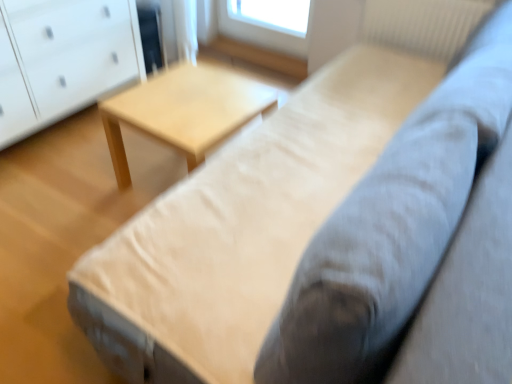
Question: Is light wood table at center oriented towards white glossy chest of drawers at left?

Choices:
 (A) no
 (B) yes

Answer: (A)

Question: From the image's perspective, is light wood table at center under white glossy chest of drawers at left?

Choices:
 (A) yes
 (B) no

Answer: (A)

Question: Can you confirm if light wood table at center is shorter than white glossy chest of drawers at left?

Choices:
 (A) no
 (B) yes

Answer: (B)

Question: Is light wood table at center wider than white glossy chest of drawers at left?

Choices:
 (A) no
 (B) yes

Answer: (B)

Question: Is light wood table at center at the right side of white glossy chest of drawers at left?

Choices:
 (A) yes
 (B) no

Answer: (A)

Question: From the image's perspective, is white glossy chest of drawers at left located above or below white textured radiator at upper right?

Choices:
 (A) above
 (B) below

Answer: (B)

Question: From a real-world perspective, is white glossy chest of drawers at left physically located above or below white textured radiator at upper right?

Choices:
 (A) below
 (B) above

Answer: (A)

Question: Based on their sizes in the image, would you say white glossy chest of drawers at left is bigger or smaller than white textured radiator at upper right?

Choices:
 (A) big
 (B) small

Answer: (A)

Question: Considering their positions, is white glossy chest of drawers at left located in front of or behind white textured radiator at upper right?

Choices:
 (A) behind
 (B) front

Answer: (B)

Question: Considering the positions of light wood table at center and white textured radiator at upper right in the image, is light wood table at center taller or shorter than white textured radiator at upper right?

Choices:
 (A) short
 (B) tall

Answer: (A)

Question: Looking at the image, does light wood table at center seem bigger or smaller compared to white textured radiator at upper right?

Choices:
 (A) small
 (B) big

Answer: (B)

Question: Looking at their shapes, would you say light wood table at center is wider or thinner than white textured radiator at upper right?

Choices:
 (A) wide
 (B) thin

Answer: (A)

Question: Does point (119, 168) appear closer or farther from the camera than point (464, 23)?

Choices:
 (A) closer
 (B) farther

Answer: (A)

Question: Looking at the image, does light wood table at center seem bigger or smaller compared to white glossy chest of drawers at left?

Choices:
 (A) small
 (B) big

Answer: (A)

Question: In terms of height, does light wood table at center look taller or shorter compared to white glossy chest of drawers at left?

Choices:
 (A) short
 (B) tall

Answer: (A)